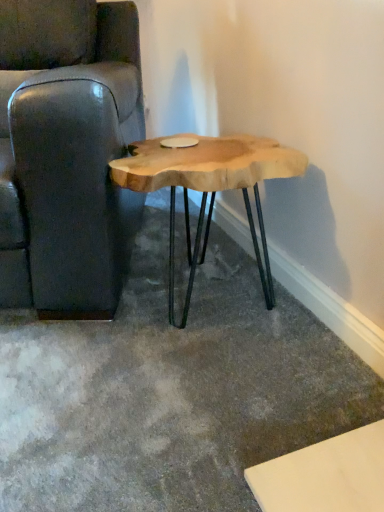
The height and width of the screenshot is (512, 384). What are the coordinates of `leather couch at left` in the screenshot? It's located at (67, 154).

This screenshot has width=384, height=512. What do you see at coordinates (67, 154) in the screenshot? I see `leather couch at left` at bounding box center [67, 154].

Locate an element on the screen. Image resolution: width=384 pixels, height=512 pixels. natural wood table at center is located at coordinates (208, 187).

What do you see at coordinates (208, 187) in the screenshot? The image size is (384, 512). I see `natural wood table at center` at bounding box center [208, 187].

You are a GUI agent. You are given a task and a screenshot of the screen. Output one action in this format:
    pyautogui.click(x=<x>, y=<y>)
    Task: Click on the leather couch at left
    The image size is (384, 512).
    Given the screenshot: What is the action you would take?
    pyautogui.click(x=67, y=154)

Which is more to the right, natural wood table at center or leather couch at left?

From the viewer's perspective, natural wood table at center appears more on the right side.

Is natural wood table at center in front of leather couch at left?

No, natural wood table at center is further to the viewer.

Is point (255, 239) positioned in front of point (67, 141)?

No, it is behind (67, 141).

From the image's perspective, is natural wood table at center positioned above or below leather couch at left?

From the image's perspective, natural wood table at center appears below leather couch at left.

Looking at this image, from a real-world perspective, which is physically above, natural wood table at center or leather couch at left?

leather couch at left.

Which of these two, natural wood table at center or leather couch at left, is thinner?

natural wood table at center.

In the scene shown: Is natural wood table at center taller or shorter than leather couch at left?

natural wood table at center is shorter than leather couch at left.

Does natural wood table at center have a smaller size compared to leather couch at left?

Yes.

Is natural wood table at center positioned beyond the bounds of leather couch at left?

That's correct, natural wood table at center is outside of leather couch at left.

Is natural wood table at center next to leather couch at left?

No.

Is natural wood table at center looking in the opposite direction of leather couch at left?

That's not correct — natural wood table at center is not looking away from leather couch at left.

What's the angular difference between natural wood table at center and leather couch at left's facing directions?

They differ by 11.6 degrees in their facing directions.

Where is `chair above the natural wood table at center (from a real-world perspective)`? Image resolution: width=384 pixels, height=512 pixels. chair above the natural wood table at center (from a real-world perspective) is located at coordinates (67, 154).

Is leather couch at left to the left of natural wood table at center from the viewer's perspective?

Correct, you'll find leather couch at left to the left of natural wood table at center.

Considering the positions of objects leather couch at left and natural wood table at center in the image provided, who is behind, leather couch at left or natural wood table at center?

Positioned behind is natural wood table at center.

Which is closer, (69, 17) or (277, 166)?

Point (69, 17).

From the image's perspective, relative to natural wood table at center, is leather couch at left above or below?

From the image's perspective, leather couch at left appears above natural wood table at center.

From a real-world perspective, is leather couch at left below natural wood table at center?

No.

Is leather couch at left wider than natural wood table at center?

Yes.

Is leather couch at left taller or shorter than natural wood table at center?

leather couch at left is taller than natural wood table at center.

Does leather couch at left have a larger size compared to natural wood table at center?

Yes, leather couch at left is bigger than natural wood table at center.

Is leather couch at left not within natural wood table at center?

Yes, leather couch at left is located beyond the bounds of natural wood table at center.

Is the surface of leather couch at left in direct contact with natural wood table at center?

No, leather couch at left is not beside natural wood table at center.

Is leather couch at left aimed at natural wood table at center?

No, leather couch at left is not aimed at natural wood table at center.

Can you tell me how much leather couch at left and natural wood table at center differ in facing direction?

11.6 degrees separate the facing orientations of leather couch at left and natural wood table at center.

What are the coordinates of `coffee table located underneath the leather couch at left (from a real-world perspective)` in the screenshot? It's located at (208, 187).

At what (x,y) coordinates should I click in order to perform the action: click on coffee table below the leather couch at left (from the image's perspective). Please return your answer as a coordinate pair (x, y). Image resolution: width=384 pixels, height=512 pixels. Looking at the image, I should click on (208, 187).

Image resolution: width=384 pixels, height=512 pixels. There is a natural wood table at center. In order to click on chair above it (from a real-world perspective) in this screenshot , I will do `click(67, 154)`.